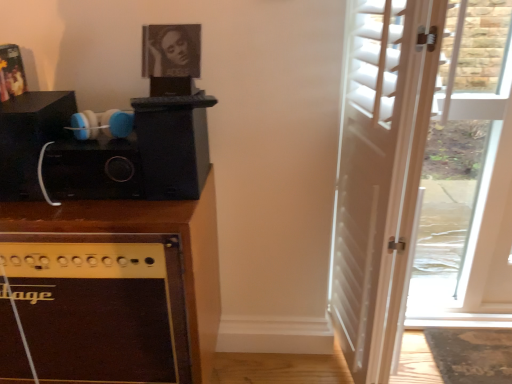
I want to click on brown wood cabinet at left, so click(121, 287).

What is the approximate height of white wood door at right?

3.59 feet.

Locate an element on the screen. white wood door at right is located at coordinates (420, 174).

Image resolution: width=512 pixels, height=384 pixels. What are the coordinates of `matte black picture frame at upper center` in the screenshot? It's located at (170, 50).

Locate an element on the screen. This screenshot has width=512, height=384. picture frame above the brown wood cabinet at left (from the image's perspective) is located at coordinates (170, 50).

Which is more to the right, brown wood cabinet at left or matte black picture frame at upper center?

matte black picture frame at upper center.

Is brown wood cabinet at left next to matte black picture frame at upper center and touching it?

No, brown wood cabinet at left is not making contact with matte black picture frame at upper center.

Is point (186, 241) closer or farther from the camera than point (169, 30)?

Point (186, 241).

Is matte black picture frame at upper center not within brown wood cabinet at left?

matte black picture frame at upper center lies outside brown wood cabinet at left's area.

Is point (191, 26) closer to viewer compared to point (214, 302)?

Yes, point (191, 26) is closer to viewer.

Considering the sizes of objects matte black picture frame at upper center and brown wood cabinet at left in the image provided, who is shorter, matte black picture frame at upper center or brown wood cabinet at left?

Standing shorter between the two is matte black picture frame at upper center.

Who is smaller, white wood door at right or brown wood cabinet at left?

white wood door at right.

Is white wood door at right surrounding brown wood cabinet at left?

No.

From a real-world perspective, is white wood door at right beneath brown wood cabinet at left?

Incorrect, from a real-world perspective, white wood door at right is higher than brown wood cabinet at left.

Considering the sizes of objects white wood door at right and brown wood cabinet at left in the image provided, who is wider, white wood door at right or brown wood cabinet at left?

With larger width is white wood door at right.

From a real-world perspective, is white wood door at right physically located above or below matte black picture frame at upper center?

Clearly, from a real-world perspective, white wood door at right is below matte black picture frame at upper center.

The height and width of the screenshot is (384, 512). What are the coordinates of `door that appears below the matte black picture frame at upper center (from the image's perspective)` in the screenshot? It's located at (420, 174).

Does white wood door at right have a lesser width compared to matte black picture frame at upper center?

In fact, white wood door at right might be wider than matte black picture frame at upper center.

Would you say matte black picture frame at upper center is a long distance from white wood door at right?

Actually, matte black picture frame at upper center and white wood door at right are a little close together.

From the image's perspective, which is above, matte black picture frame at upper center or white wood door at right?

matte black picture frame at upper center appears higher in the image.

From the picture: Could white wood door at right be considered to be inside matte black picture frame at upper center?

No.

Considering the sizes of brown wood cabinet at left and white wood door at right in the image, is brown wood cabinet at left taller or shorter than white wood door at right?

Clearly, brown wood cabinet at left is shorter compared to white wood door at right.

From the image's perspective, is brown wood cabinet at left located above or below white wood door at right?

Clearly, from the image's perspective, brown wood cabinet at left is below white wood door at right.

Considering the points (117, 300) and (481, 43), which point is in front, point (117, 300) or point (481, 43)?

Positioned in front is point (117, 300).

Considering the relative sizes of brown wood cabinet at left and white wood door at right in the image provided, is brown wood cabinet at left smaller than white wood door at right?

No, brown wood cabinet at left is not smaller than white wood door at right.

This screenshot has height=384, width=512. I want to click on picture frame above the brown wood cabinet at left (from a real-world perspective), so click(170, 50).

The width and height of the screenshot is (512, 384). In the image, there is a matte black picture frame at upper center. Find the location of `cabinetry below it (from the image's perspective)`. cabinetry below it (from the image's perspective) is located at coordinates (121, 287).

Which object lies nearer to the anchor point brown wood cabinet at left, white wood door at right or matte black picture frame at upper center?

matte black picture frame at upper center.

From the image, which object appears to be farther from brown wood cabinet at left, matte black picture frame at upper center or white wood door at right?

white wood door at right is further to brown wood cabinet at left.

Based on their spatial positions, is brown wood cabinet at left or white wood door at right further from matte black picture frame at upper center?

Based on the image, white wood door at right appears to be further to matte black picture frame at upper center.

Estimate the real-world distances between objects in this image. Which object is further from white wood door at right, brown wood cabinet at left or matte black picture frame at upper center?

matte black picture frame at upper center.

Estimate the real-world distances between objects in this image. Which object is further from matte black picture frame at upper center, white wood door at right or brown wood cabinet at left?

Based on the image, white wood door at right appears to be further to matte black picture frame at upper center.

From the image, which object appears to be nearer to white wood door at right, matte black picture frame at upper center or brown wood cabinet at left?

brown wood cabinet at left lies closer to white wood door at right than the other object.

Locate an element on the screen. picture frame located between brown wood cabinet at left and white wood door at right in the left-right direction is located at coordinates (170, 50).